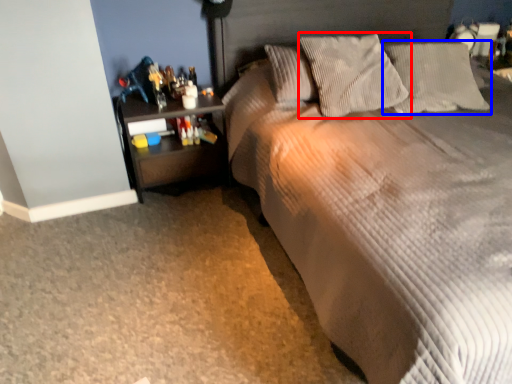
Question: Among these objects, which one is farthest to the camera, pillow (highlighted by a red box) or pillow (highlighted by a blue box)?

Choices:
 (A) pillow
 (B) pillow

Answer: (B)